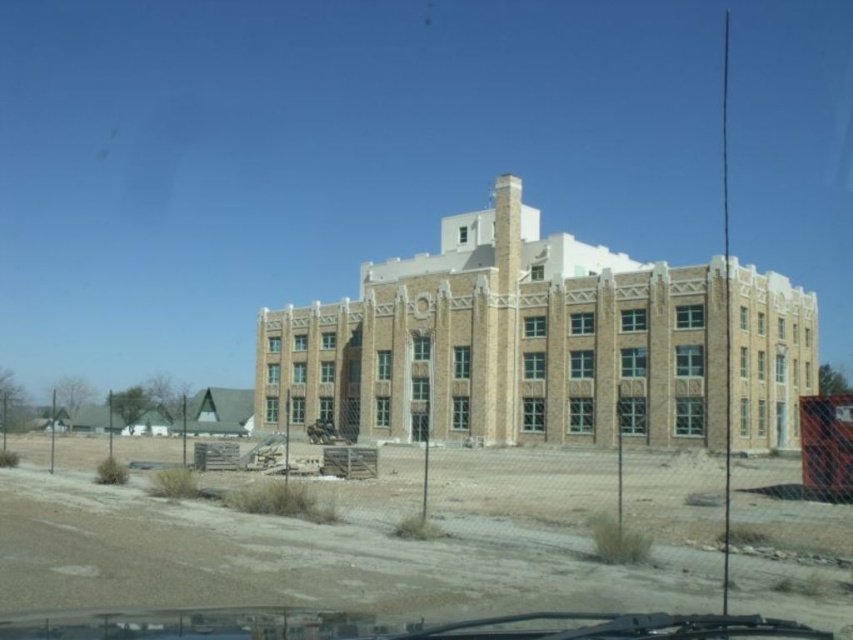
Question: Which point is closer to the camera?

Choices:
 (A) beige brick building at center
 (B) dirt field at lower left

Answer: (B)

Question: Which point is farther from the camera taking this photo?

Choices:
 (A) (612, 323)
 (B) (482, 566)

Answer: (A)

Question: From the image, what is the correct spatial relationship of dirt field at lower left in relation to beige brick building at center?

Choices:
 (A) below
 (B) above

Answer: (A)

Question: Can you confirm if dirt field at lower left is positioned to the right of beige brick building at center?

Choices:
 (A) yes
 (B) no

Answer: (B)

Question: Does dirt field at lower left appear under beige brick building at center?

Choices:
 (A) no
 (B) yes

Answer: (B)